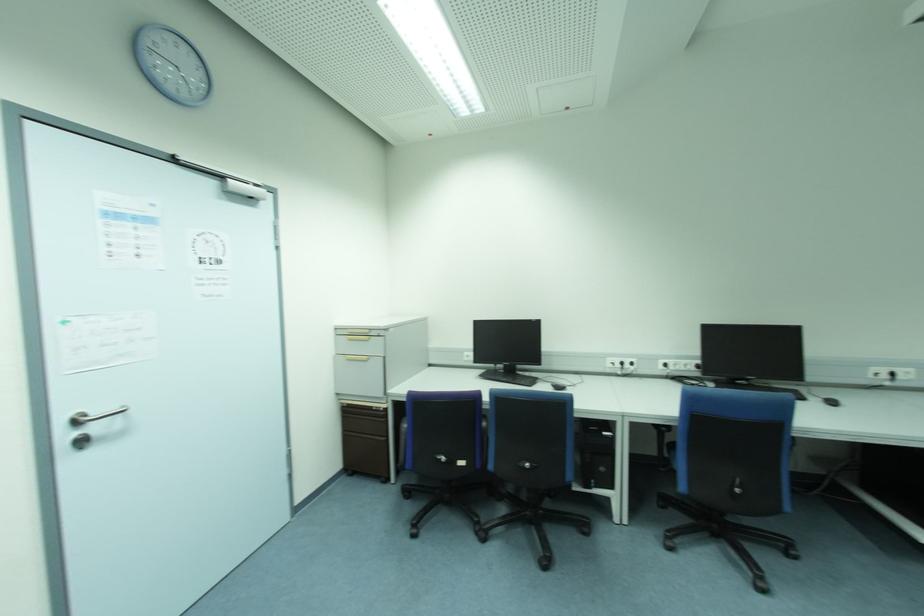
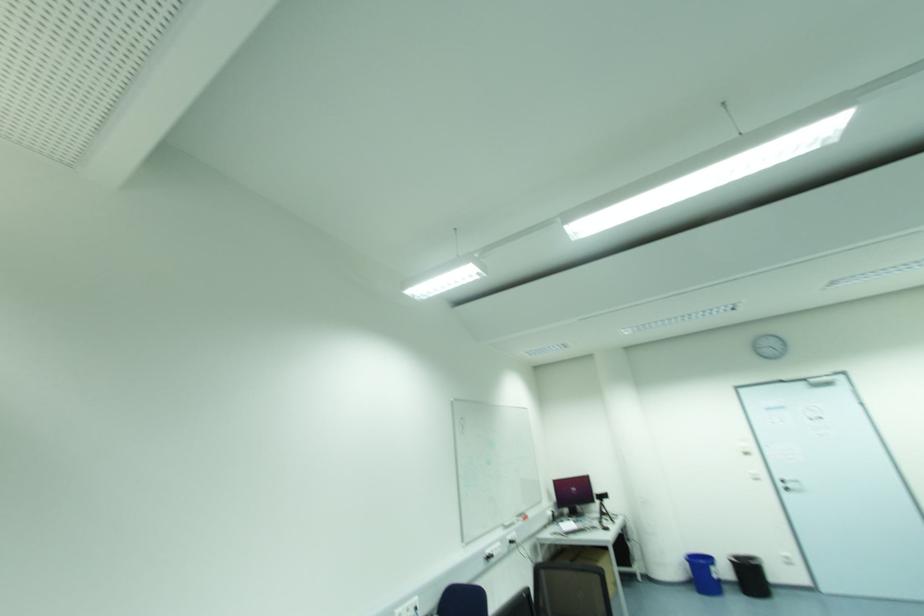
Locate, in the second image, the point that corresponds to (98,427) in the first image.

(789, 485)